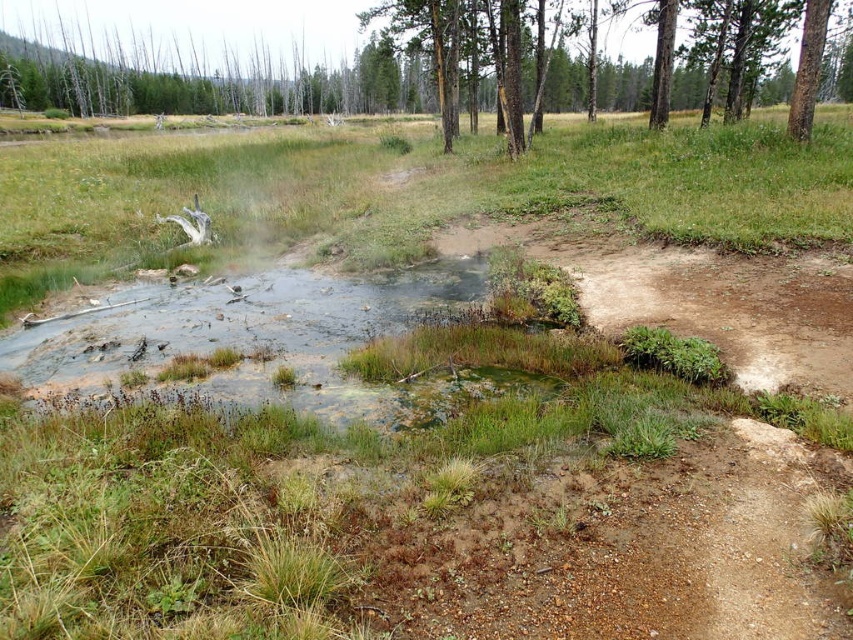
You are standing at the edge of the pond in the meadow and see two points marked in the image. The first point is at coordinates point (724, 19) and the second is at point (804, 138). Which point is closer to you?

Point (804, 138) is closer to you because it is in front of point (724, 19).